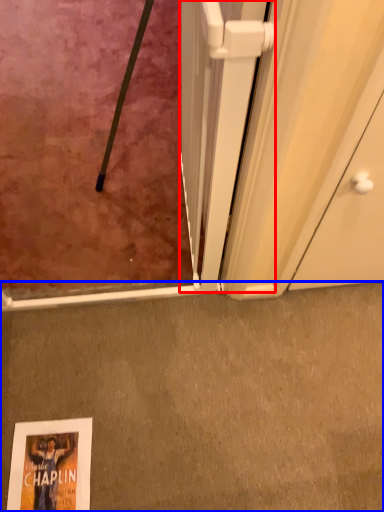
Question: Among these objects, which one is farthest to the camera, screen door (highlighted by a red box) or concrete (highlighted by a blue box)?

Choices:
 (A) screen door
 (B) concrete

Answer: (B)